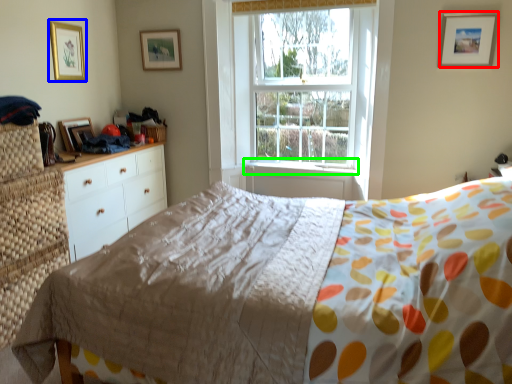
Question: Considering the real-world distances, which object is closest to picture frame (highlighted by a red box)? picture frame (highlighted by a blue box) or window sill (highlighted by a green box).

Choices:
 (A) picture frame
 (B) window sill

Answer: (B)